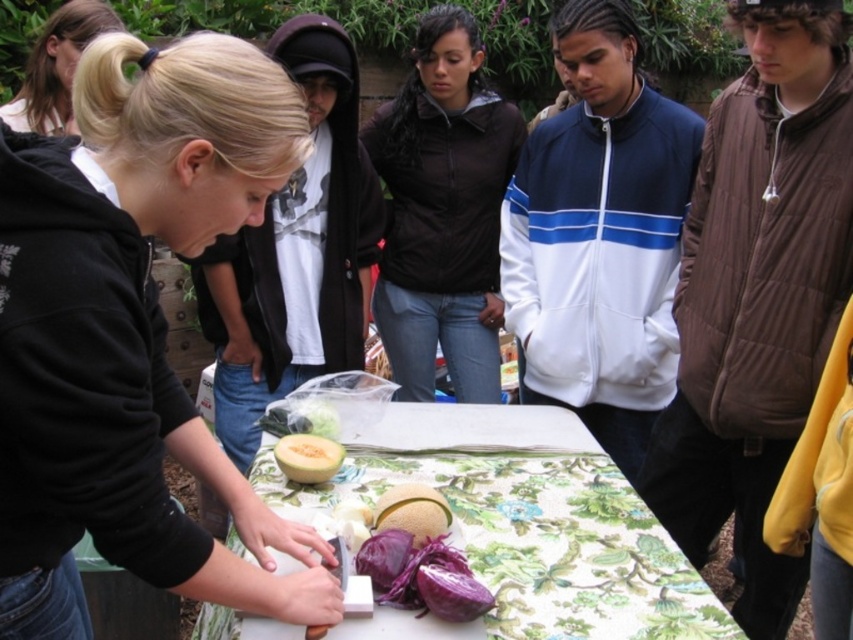
Question: Which of the following is the farthest from the observer?

Choices:
 (A) purple matte cabbage at center
 (B) smooth yellow cantaloupe at center
 (C) brown puffy vest at right

Answer: (B)

Question: Does purple matte cabbage at center lie in front of green matte melon at center?

Choices:
 (A) no
 (B) yes

Answer: (B)

Question: Which object is farther from the camera taking this photo?

Choices:
 (A) floral-patterned tablecloth at center
 (B) black matte hoodie at center
 (C) smooth yellow melon at center

Answer: (C)

Question: Can you confirm if floral-patterned tablecloth at center is smaller than smooth yellow melon at center?

Choices:
 (A) no
 (B) yes

Answer: (A)

Question: Can you confirm if floral-patterned tablecloth at center is smaller than smooth yellow melon at center?

Choices:
 (A) no
 (B) yes

Answer: (A)

Question: Which object is closer to the camera taking this photo?

Choices:
 (A) black softshell jacket at center
 (B) blonde hair at upper left
 (C) black matte hoodie at center
 (D) white/blue zip-up jacket at center

Answer: (C)